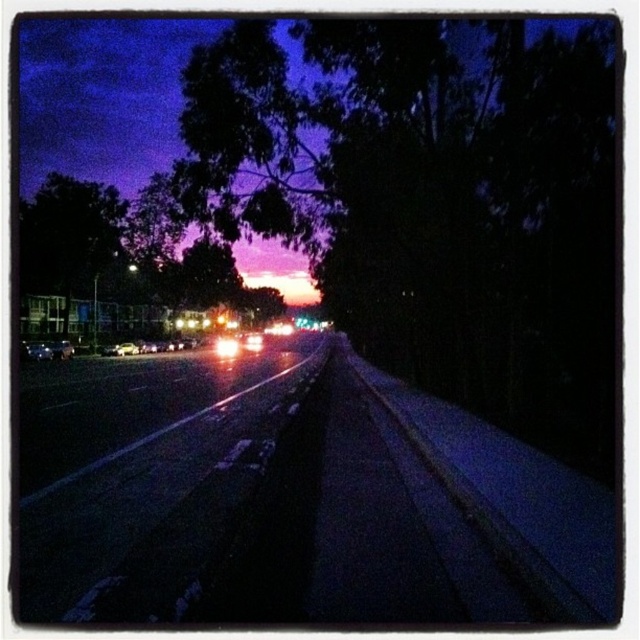
Can you confirm if green leafy tree at center is smaller than shiny silver car at left?

Incorrect, green leafy tree at center is not smaller in size than shiny silver car at left.

Who is shorter, green leafy tree at center or shiny silver car at left?

shiny silver car at left

Find the location of a particular element. The width and height of the screenshot is (640, 640). green leafy tree at center is located at coordinates (122, 264).

Can you confirm if metallic reflective road at center is wider than bright white plastic headlight at center?

No.

What do you see at coordinates (157, 492) in the screenshot? I see `metallic reflective road at center` at bounding box center [157, 492].

Identify the location of metallic reflective road at center. (157, 492).

Can you confirm if metallic reflective road at center is bigger than green leafy tree at center?

No.

Based on the photo, is metallic reflective road at center to the right of green leafy tree at center from the viewer's perspective?

Correct, you'll find metallic reflective road at center to the right of green leafy tree at center.

In order to click on metallic reflective road at center in this screenshot , I will do `click(157, 492)`.

This screenshot has height=640, width=640. I want to click on metallic reflective road at center, so click(x=157, y=492).